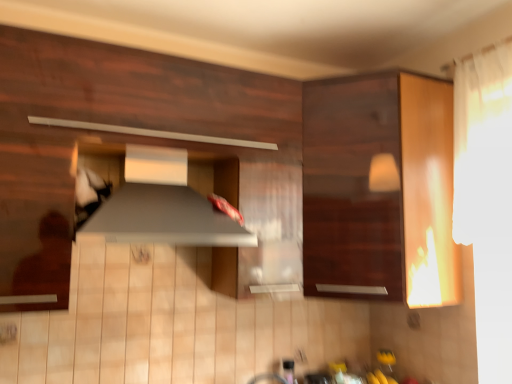
Describe the element at coordinates (161, 205) in the screenshot. The width and height of the screenshot is (512, 384). I see `satin silver exhaust hood at center` at that location.

Identify the location of satin silver exhaust hood at center. Image resolution: width=512 pixels, height=384 pixels. (161, 205).

Where is `exhaust hood lying behind the matte wood cabinet at center, marked as the 1th cabinetry in a left-to-right arrangement`? exhaust hood lying behind the matte wood cabinet at center, marked as the 1th cabinetry in a left-to-right arrangement is located at coordinates (161, 205).

Does satin silver exhaust hood at center appear on the left side of matte wood cabinet at center, placed as the second cabinetry when sorted from right to left?

No.

Are satin silver exhaust hood at center and matte wood cabinet at center, marked as the 1th cabinetry in a left-to-right arrangement, beside each other?

No.

Is wooden cabinet at right, the 1th cabinetry when ordered from right to left, bigger or smaller than satin silver exhaust hood at center?

Clearly, wooden cabinet at right, the 1th cabinetry when ordered from right to left, is larger in size than satin silver exhaust hood at center.

Locate an element on the screen. Image resolution: width=512 pixels, height=384 pixels. exhaust hood beneath the wooden cabinet at right, the 1th cabinetry when ordered from right to left (from a real-world perspective) is located at coordinates (161, 205).

From the picture: Does wooden cabinet at right, the 1th cabinetry when ordered from right to left, appear on the right side of satin silver exhaust hood at center?

Indeed, wooden cabinet at right, the 1th cabinetry when ordered from right to left, is positioned on the right side of satin silver exhaust hood at center.

Which object is further away from the camera taking this photo, wooden cabinet at right, the 1th cabinetry when ordered from right to left, or satin silver exhaust hood at center?

wooden cabinet at right, the 1th cabinetry when ordered from right to left.

Can you confirm if satin silver exhaust hood at center is shorter than wooden cabinet at right, the 1th cabinetry when ordered from right to left?

Indeed, satin silver exhaust hood at center has a lesser height compared to wooden cabinet at right, the 1th cabinetry when ordered from right to left.

Is satin silver exhaust hood at center inside the boundaries of wooden cabinet at right, which ranks as the second cabinetry in left-to-right order, or outside?

satin silver exhaust hood at center is not enclosed by wooden cabinet at right, which ranks as the second cabinetry in left-to-right order.

How different are the orientations of satin silver exhaust hood at center and wooden cabinet at right, the 1th cabinetry when ordered from right to left, in degrees?

There is a 0.065-degree angle between the facing directions of satin silver exhaust hood at center and wooden cabinet at right, the 1th cabinetry when ordered from right to left.

From a real-world perspective, is matte wood cabinet at center, marked as the 1th cabinetry in a left-to-right arrangement, positioned over wooden cabinet at right, the 1th cabinetry when ordered from right to left, based on gravity?

Yes, from a real-world perspective, matte wood cabinet at center, marked as the 1th cabinetry in a left-to-right arrangement, is on top of wooden cabinet at right, the 1th cabinetry when ordered from right to left.

Consider the image. Would you say matte wood cabinet at center, placed as the second cabinetry when sorted from right to left, is a long distance from wooden cabinet at right, which ranks as the second cabinetry in left-to-right order?

matte wood cabinet at center, placed as the second cabinetry when sorted from right to left, is near wooden cabinet at right, which ranks as the second cabinetry in left-to-right order, not far away.

The height and width of the screenshot is (384, 512). In order to click on cabinetry below the matte wood cabinet at center, placed as the second cabinetry when sorted from right to left (from the image's perspective) in this screenshot , I will do `click(380, 192)`.

From the image's perspective, is matte wood cabinet at center, placed as the second cabinetry when sorted from right to left, located above satin silver exhaust hood at center?

Yes, from the image's perspective, matte wood cabinet at center, placed as the second cabinetry when sorted from right to left, is on top of satin silver exhaust hood at center.

Would you say matte wood cabinet at center, marked as the 1th cabinetry in a left-to-right arrangement, is outside satin silver exhaust hood at center?

Indeed, matte wood cabinet at center, marked as the 1th cabinetry in a left-to-right arrangement, is completely outside satin silver exhaust hood at center.

Considering the sizes of matte wood cabinet at center, placed as the second cabinetry when sorted from right to left, and satin silver exhaust hood at center in the image, is matte wood cabinet at center, placed as the second cabinetry when sorted from right to left, bigger or smaller than satin silver exhaust hood at center?

Considering their sizes, matte wood cabinet at center, placed as the second cabinetry when sorted from right to left, takes up more space than satin silver exhaust hood at center.

In the scene shown: Is matte wood cabinet at center, marked as the 1th cabinetry in a left-to-right arrangement, at the right side of satin silver exhaust hood at center?

No.

Looking at this image, from the image's perspective, would you say wooden cabinet at right, the 1th cabinetry when ordered from right to left, is shown under matte wood cabinet at center, marked as the 1th cabinetry in a left-to-right arrangement?

Yes, from the image's perspective, wooden cabinet at right, the 1th cabinetry when ordered from right to left, is beneath matte wood cabinet at center, marked as the 1th cabinetry in a left-to-right arrangement.

Is wooden cabinet at right, which ranks as the second cabinetry in left-to-right order, positioned with its back to matte wood cabinet at center, placed as the second cabinetry when sorted from right to left?

That's not correct — wooden cabinet at right, which ranks as the second cabinetry in left-to-right order, is not looking away from matte wood cabinet at center, placed as the second cabinetry when sorted from right to left.

Considering the sizes of objects wooden cabinet at right, which ranks as the second cabinetry in left-to-right order, and matte wood cabinet at center, marked as the 1th cabinetry in a left-to-right arrangement, in the image provided, who is shorter, wooden cabinet at right, which ranks as the second cabinetry in left-to-right order, or matte wood cabinet at center, marked as the 1th cabinetry in a left-to-right arrangement,?

matte wood cabinet at center, marked as the 1th cabinetry in a left-to-right arrangement, is shorter.

Which object is further away from the camera, wooden cabinet at right, which ranks as the second cabinetry in left-to-right order, or matte wood cabinet at center, marked as the 1th cabinetry in a left-to-right arrangement?

wooden cabinet at right, which ranks as the second cabinetry in left-to-right order, is behind.

Locate an element on the screen. exhaust hood below the matte wood cabinet at center, placed as the second cabinetry when sorted from right to left (from a real-world perspective) is located at coordinates (161, 205).

Image resolution: width=512 pixels, height=384 pixels. What are the coordinates of `cabinetry behind the satin silver exhaust hood at center` in the screenshot? It's located at (380, 192).

When comparing their distances from matte wood cabinet at center, marked as the 1th cabinetry in a left-to-right arrangement, does wooden cabinet at right, the 1th cabinetry when ordered from right to left, or satin silver exhaust hood at center seem closer?

The object closer to matte wood cabinet at center, marked as the 1th cabinetry in a left-to-right arrangement, is satin silver exhaust hood at center.

Looking at the image, which one is located further to satin silver exhaust hood at center, matte wood cabinet at center, placed as the second cabinetry when sorted from right to left, or wooden cabinet at right, the 1th cabinetry when ordered from right to left?

Based on the image, wooden cabinet at right, the 1th cabinetry when ordered from right to left, appears to be further to satin silver exhaust hood at center.

From the image, which object appears to be nearer to satin silver exhaust hood at center, wooden cabinet at right, the 1th cabinetry when ordered from right to left, or matte wood cabinet at center, marked as the 1th cabinetry in a left-to-right arrangement?

matte wood cabinet at center, marked as the 1th cabinetry in a left-to-right arrangement, lies closer to satin silver exhaust hood at center than the other object.

Which object lies further to the anchor point matte wood cabinet at center, marked as the 1th cabinetry in a left-to-right arrangement, satin silver exhaust hood at center or wooden cabinet at right, which ranks as the second cabinetry in left-to-right order?

wooden cabinet at right, which ranks as the second cabinetry in left-to-right order, is further to matte wood cabinet at center, marked as the 1th cabinetry in a left-to-right arrangement.

From the picture: Looking at the image, which one is located closer to wooden cabinet at right, which ranks as the second cabinetry in left-to-right order, satin silver exhaust hood at center or matte wood cabinet at center, placed as the second cabinetry when sorted from right to left?

matte wood cabinet at center, placed as the second cabinetry when sorted from right to left, is closer to wooden cabinet at right, which ranks as the second cabinetry in left-to-right order.

From the image, which object appears to be nearer to wooden cabinet at right, which ranks as the second cabinetry in left-to-right order, matte wood cabinet at center, placed as the second cabinetry when sorted from right to left, or satin silver exhaust hood at center?

matte wood cabinet at center, placed as the second cabinetry when sorted from right to left, lies closer to wooden cabinet at right, which ranks as the second cabinetry in left-to-right order, than the other object.

You are a GUI agent. You are given a task and a screenshot of the screen. Output one action in this format:
    pyautogui.click(x=<x>, y=<y>)
    Task: Click on the exhaust hood between matte wood cabinet at center, marked as the 1th cabinetry in a left-to-right arrangement, and wooden cabinet at right, which ranks as the second cabinetry in left-to-right order
    The image size is (512, 384).
    Given the screenshot: What is the action you would take?
    pyautogui.click(x=161, y=205)